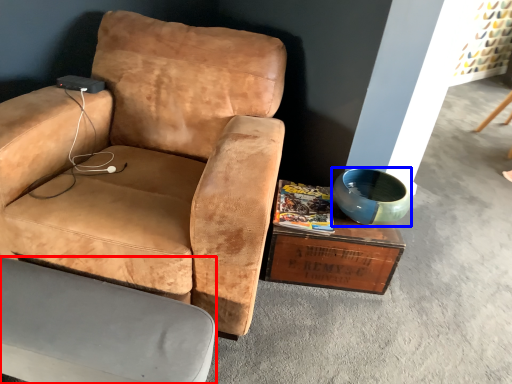
Question: Which object appears closest to the camera in this image, chair (highlighted by a red box) or bowl (highlighted by a blue box)?

Choices:
 (A) chair
 (B) bowl

Answer: (A)